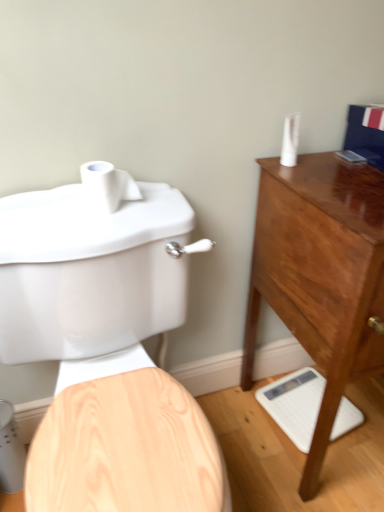
Find the location of `vacant area that lies to the right of white glossy scale at lower right`. vacant area that lies to the right of white glossy scale at lower right is located at coordinates (366, 410).